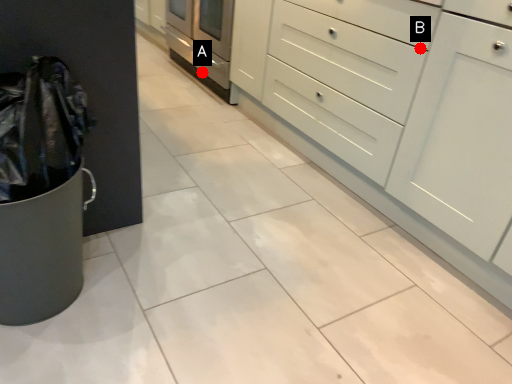
Question: Two points are circled on the image, labeled by A and B beside each circle. Which point is farther to the camera?

Choices:
 (A) A is further
 (B) B is further

Answer: (A)